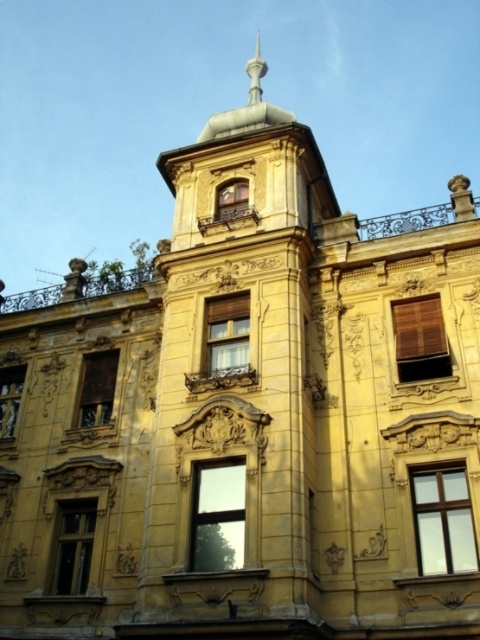
Question: Among these points, which one is nearest to the camera?

Choices:
 (A) (215, 483)
 (B) (231, 195)
 (C) (430, 349)

Answer: (A)

Question: Among these objects, which one is farthest from the camera?

Choices:
 (A) brown woven blinds at upper center
 (B) transparent glass window at center
 (C) matte gold window at left

Answer: (C)

Question: Estimate the real-world distances between objects in this image. Which object is farther from the brown matte window at center-left?

Choices:
 (A) brown matte window at center
 (B) transparent glass window at center

Answer: (B)

Question: Is the position of transparent glass window at center more distant than that of wooden textured window at center?

Choices:
 (A) yes
 (B) no

Answer: (B)

Question: Does clear glass window at center appear over brown matte window at center-left?

Choices:
 (A) no
 (B) yes

Answer: (A)

Question: Considering the relative positions of brown woven blinds at upper center and matte gold window at left in the image provided, where is brown woven blinds at upper center located with respect to matte gold window at left?

Choices:
 (A) right
 (B) left

Answer: (A)